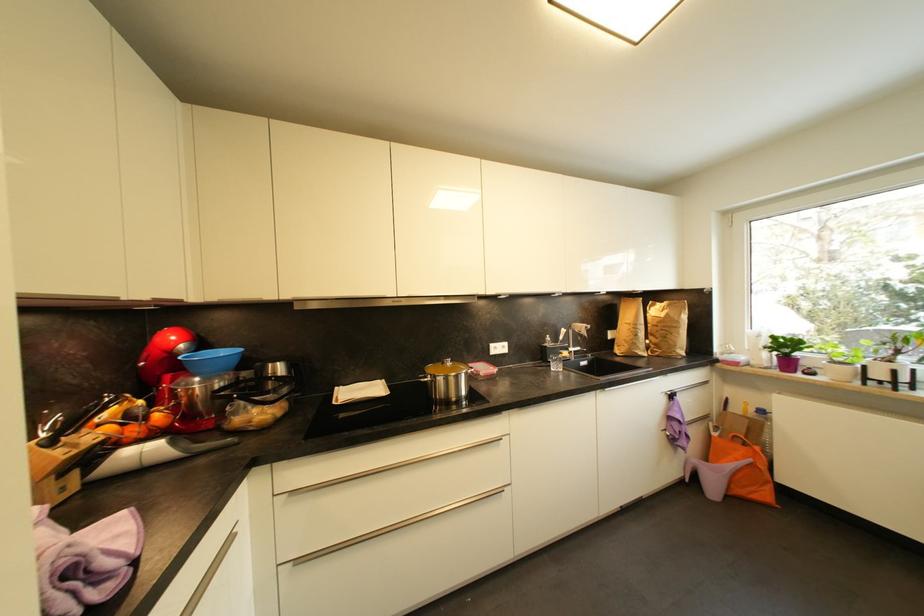
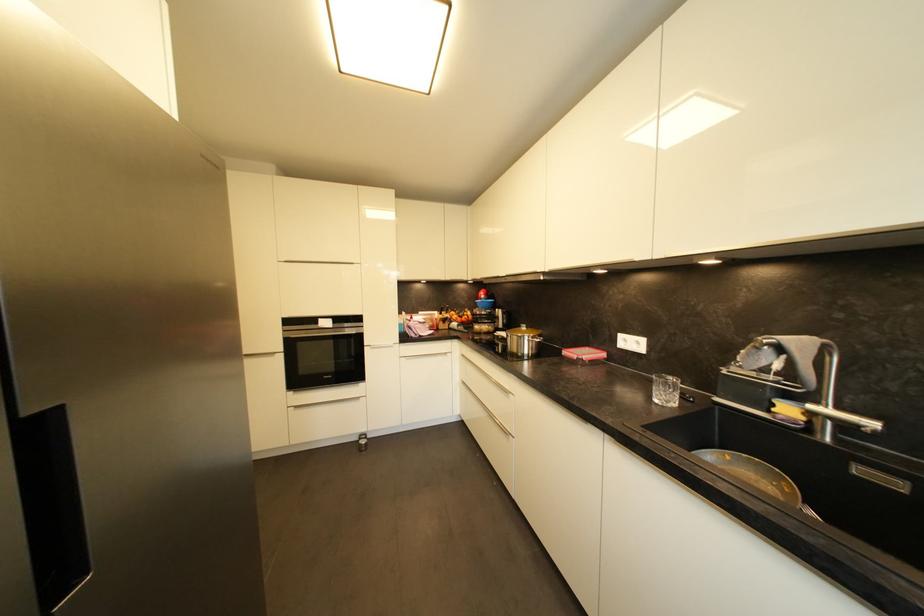
Where in the second image is the point corresponding to point 456,363 from the first image?

(531, 330)